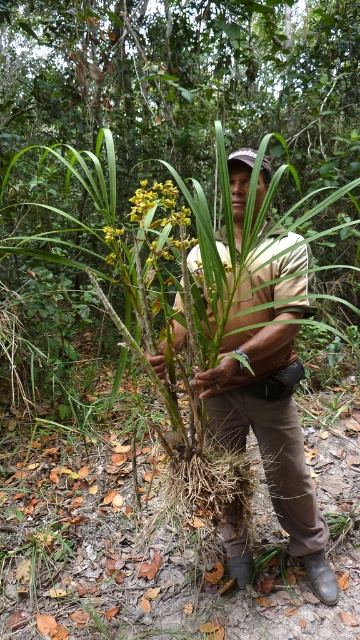
Is brown leather boots at lower center above yellow-green textured flower at center?

No.

Does brown leather boots at lower center have a lesser width compared to yellow-green textured flower at center?

Incorrect, brown leather boots at lower center's width is not less than yellow-green textured flower at center's.

Is point (330, 582) more distant than point (168, 241)?

Yes, point (330, 582) is behind point (168, 241).

Find the location of `brown leather boots at lower center`. brown leather boots at lower center is located at coordinates (271, 435).